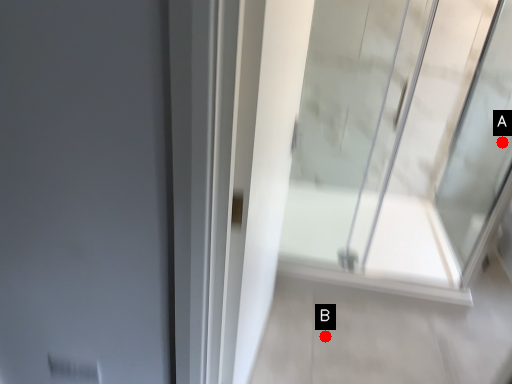
Question: Two points are circled on the image, labeled by A and B beside each circle. Which point is farther from the camera taking this photo?

Choices:
 (A) A is further
 (B) B is further

Answer: (A)